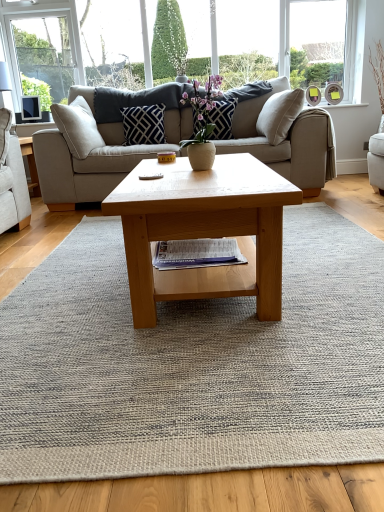
I want to click on free space above neutral woven rug at center (from a real-world perspective), so click(x=199, y=308).